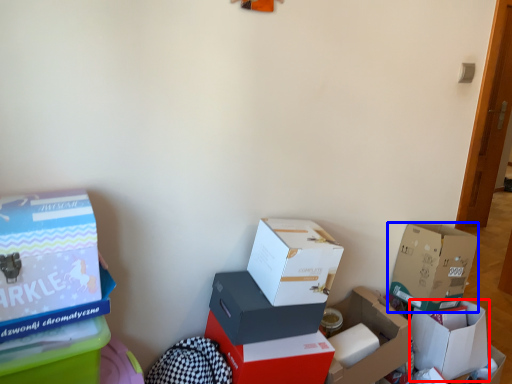
Question: Which object appears closest to the camera in this image, box (highlighted by a red box) or box (highlighted by a blue box)?

Choices:
 (A) box
 (B) box

Answer: (B)